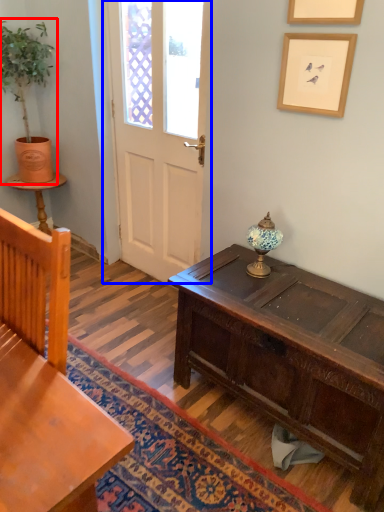
Question: Which of the following is the closest to the observer, houseplant (highlighted by a red box) or door (highlighted by a blue box)?

Choices:
 (A) houseplant
 (B) door

Answer: (B)